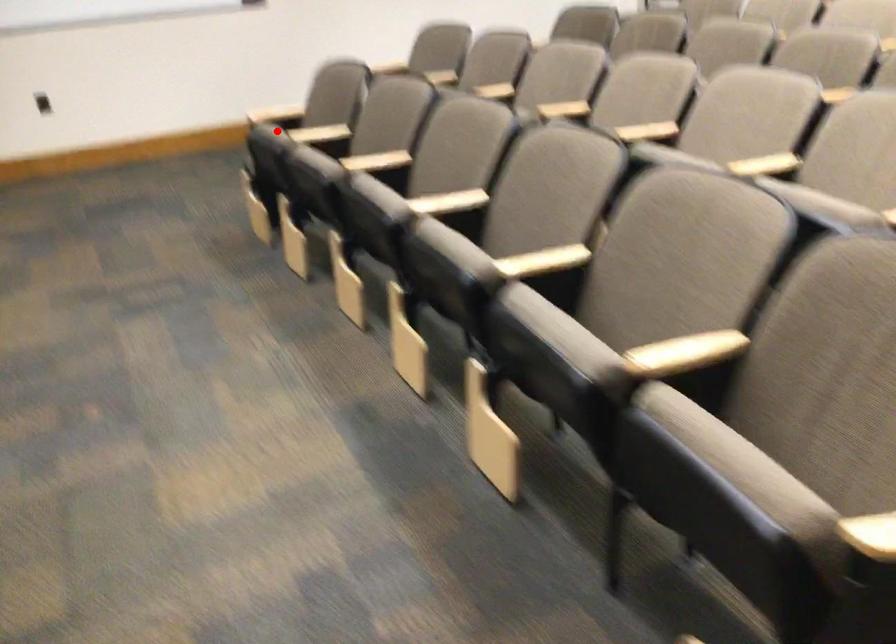
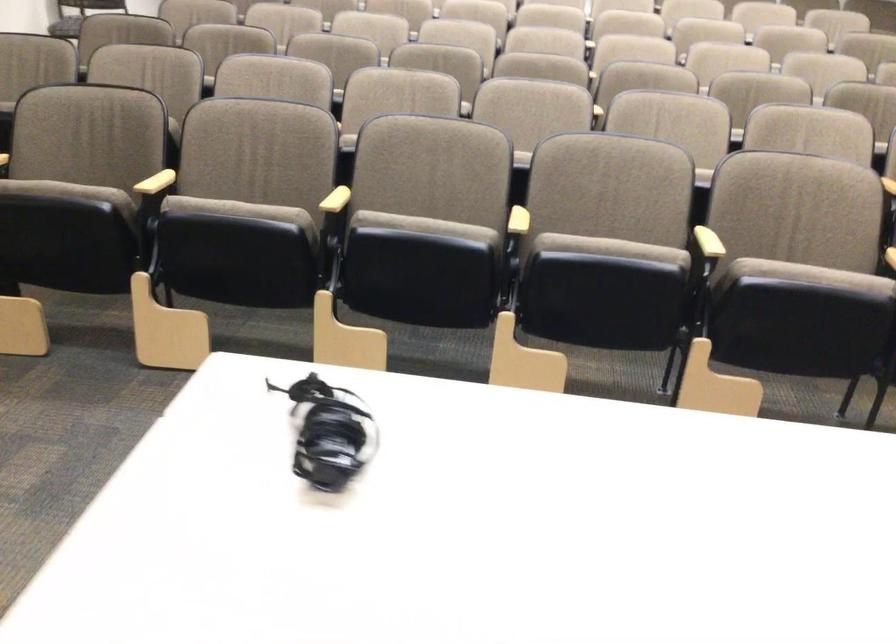
Question: I am providing you with two images of the same scene from different viewpoints. Image1 has a red point marked. In image2, the corresponding 3D location appears at what relative position? Reply with the corresponding letter.

Choices:
 (A) Closer
 (B) Farther

Answer: (A)